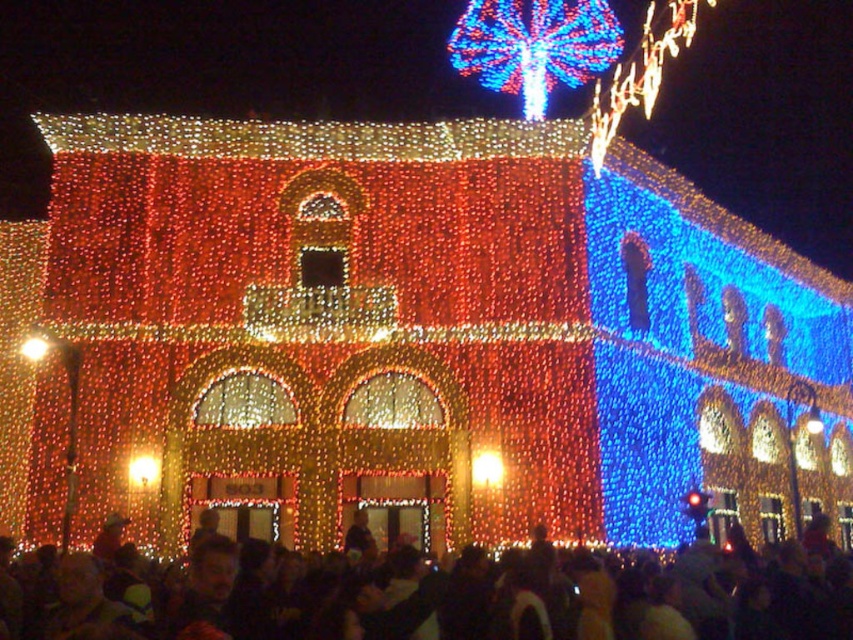
You are a drone operator tasked with delivering a package to the building. Your drone has a maximum flight distance of 30 feet. You need to fly from the matte gold light at lower left to the matte gold light at center. Can your drone make this trip without needing a recharge?

The matte gold light at center is 33.12 feet from the matte gold light at lower left. Since the drone can only fly 30 feet before needing a recharge, it cannot complete this trip without recharging.